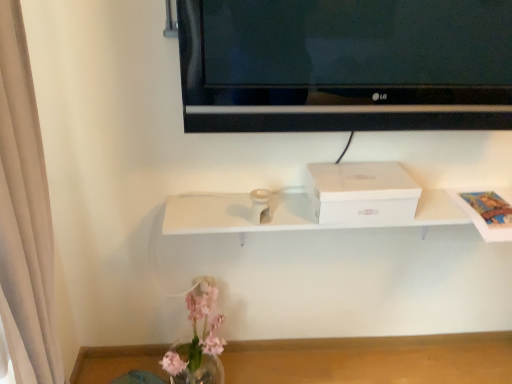
Where is `translucent glass vase at lower left`? This screenshot has height=384, width=512. translucent glass vase at lower left is located at coordinates (198, 340).

The width and height of the screenshot is (512, 384). I want to click on black glossy tv at upper center, so click(x=345, y=65).

Considering the relative sizes of black glossy tv at upper center and translucent glass vase at lower left in the image provided, is black glossy tv at upper center smaller than translucent glass vase at lower left?

Yes.

From a real-world perspective, between black glossy tv at upper center and translucent glass vase at lower left, who is vertically higher?

In real-world perspective, black glossy tv at upper center is above.

Who is more distant, black glossy tv at upper center or translucent glass vase at lower left?

translucent glass vase at lower left is further from the camera.

Between translucent glass vase at lower left and black glossy tv at upper center, which one appears on the right side from the viewer's perspective?

From the viewer's perspective, black glossy tv at upper center appears more on the right side.

Which point is more forward, (170, 359) or (410, 71)?

The point (410, 71) is in front.

Is the depth of translucent glass vase at lower left less than that of black glossy tv at upper center?

No, it is not.

Based on the photo, is translucent glass vase at lower left taller than black glossy tv at upper center?

Correct, translucent glass vase at lower left is much taller as black glossy tv at upper center.

From the image's perspective, which is above, white cardboard box at center or black glossy tv at upper center?

black glossy tv at upper center is shown above in the image.

Considering the sizes of objects white cardboard box at center and black glossy tv at upper center in the image provided, who is bigger, white cardboard box at center or black glossy tv at upper center?

With larger size is black glossy tv at upper center.

Is point (415, 205) more distant than point (442, 4)?

Yes, it is.

From a real-world perspective, who is located lower, transparent glass vase at lower center or black glossy tv at upper center?

transparent glass vase at lower center, from a real-world perspective.

Locate an element on the screen. television above the transparent glass vase at lower center (from a real-world perspective) is located at coordinates (345, 65).

Do you think transparent glass vase at lower center is within black glossy tv at upper center, or outside of it?

transparent glass vase at lower center is spatially situated outside black glossy tv at upper center.

From the image's perspective, is black glossy tv at upper center beneath white cardboard box at center?

No.

Between black glossy tv at upper center and white cardboard box at center, which one is positioned behind?

white cardboard box at center is further from the camera.

Is white cardboard box at center surrounded by black glossy tv at upper center?

That's incorrect, white cardboard box at center is not inside black glossy tv at upper center.

Is white cardboard box at center not close to transparent glass vase at lower center?

They are positioned close to each other.

Could you tell me if white cardboard box at center is turned towards transparent glass vase at lower center?

No, white cardboard box at center is not aimed at transparent glass vase at lower center.

Can you confirm if white cardboard box at center is thinner than transparent glass vase at lower center?

Yes.

Is point (328, 200) positioned in front of point (236, 374)?

Yes, it is in front of point (236, 374).

Consider the image. Is translucent glass vase at lower left facing away from white cardboard box at center?

No, translucent glass vase at lower left is not facing the opposite direction of white cardboard box at center.

From the picture: Considering the sizes of objects translucent glass vase at lower left and white cardboard box at center in the image provided, who is taller, translucent glass vase at lower left or white cardboard box at center?

translucent glass vase at lower left.

From a real-world perspective, which object rests below the other?

In real-world perspective, translucent glass vase at lower left is lower.

From the image's perspective, does translucent glass vase at lower left appear higher than white cardboard box at center?

No, from the image's perspective, translucent glass vase at lower left is not over white cardboard box at center.

Identify the location of floral arrangement behind the black glossy tv at upper center. (198, 340).

The height and width of the screenshot is (384, 512). In order to click on television in front of the translucent glass vase at lower left in this screenshot , I will do `click(345, 65)`.

Based on their spatial positions, is translucent glass vase at lower left or white cardboard box at center closer to black glossy tv at upper center?

white cardboard box at center lies closer to black glossy tv at upper center than the other object.

Which object lies nearer to the anchor point transparent glass vase at lower center, white cardboard box at center or black glossy tv at upper center?

Among the two, white cardboard box at center is located nearer to transparent glass vase at lower center.

Considering their positions, is translucent glass vase at lower left positioned further to transparent glass vase at lower center than black glossy tv at upper center?

The object further to transparent glass vase at lower center is black glossy tv at upper center.

Estimate the real-world distances between objects in this image. Which object is further from translucent glass vase at lower left, white cardboard box at center or transparent glass vase at lower center?

white cardboard box at center is positioned further to the anchor translucent glass vase at lower left.

Which object lies nearer to the anchor point translucent glass vase at lower left, transparent glass vase at lower center or white cardboard box at center?

transparent glass vase at lower center lies closer to translucent glass vase at lower left than the other object.

Considering their positions, is transparent glass vase at lower center positioned further to black glossy tv at upper center than translucent glass vase at lower left?

Among the two, transparent glass vase at lower center is located further to black glossy tv at upper center.

Considering their positions, is translucent glass vase at lower left positioned further to transparent glass vase at lower center than white cardboard box at center?

Based on the image, white cardboard box at center appears to be further to transparent glass vase at lower center.

Considering their positions, is white cardboard box at center positioned further to transparent glass vase at lower center than translucent glass vase at lower left?

Based on the image, white cardboard box at center appears to be further to transparent glass vase at lower center.

Find the location of a particular element. This screenshot has width=512, height=384. box between black glossy tv at upper center and translucent glass vase at lower left in the up-down direction is located at coordinates (361, 192).

Locate an element on the screen. This screenshot has height=384, width=512. box between black glossy tv at upper center and transparent glass vase at lower center in the up-down direction is located at coordinates (361, 192).

Locate an element on the screen. floral arrangement between black glossy tv at upper center and transparent glass vase at lower center in the up-down direction is located at coordinates (198, 340).

Locate an element on the screen. Image resolution: width=512 pixels, height=384 pixels. floral arrangement that lies between white cardboard box at center and transparent glass vase at lower center from top to bottom is located at coordinates (198, 340).